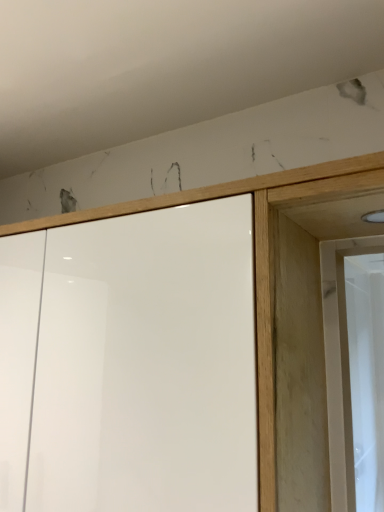
Describe the element at coordinates (362, 376) in the screenshot. I see `white glossy screen door at right` at that location.

Where is `white glossy screen door at right`? This screenshot has height=512, width=384. white glossy screen door at right is located at coordinates (362, 376).

What do you see at coordinates (255, 260) in the screenshot? I see `white glossy cupboard at center` at bounding box center [255, 260].

Identify the location of white glossy cupboard at center. This screenshot has width=384, height=512. (255, 260).

I want to click on white glossy screen door at right, so click(x=362, y=376).

Considering the relative positions of white glossy cupboard at center and white glossy screen door at right in the image provided, is white glossy cupboard at center to the left or to the right of white glossy screen door at right?

In the image, white glossy cupboard at center appears on the left side of white glossy screen door at right.

Which object is further away from the camera taking this photo, white glossy cupboard at center or white glossy screen door at right?

white glossy screen door at right is more distant.

Considering the positions of point (256, 220) and point (364, 348), is point (256, 220) closer or farther from the camera than point (364, 348)?

Point (256, 220) is positioned closer to the camera compared to point (364, 348).

From the image's perspective, is white glossy cupboard at center beneath white glossy screen door at right?

Yes, from the image's perspective, white glossy cupboard at center is below white glossy screen door at right.

From the picture: From a real-world perspective, is white glossy cupboard at center over white glossy screen door at right?

No, from a real-world perspective, white glossy cupboard at center is not over white glossy screen door at right

Which object is thinner, white glossy cupboard at center or white glossy screen door at right?

With smaller width is white glossy screen door at right.

Does white glossy cupboard at center have a greater height compared to white glossy screen door at right?

Yes.

Between white glossy cupboard at center and white glossy screen door at right, which one has larger size?

Bigger between the two is white glossy cupboard at center.

Is white glossy screen door at right located within white glossy cupboard at center?

No, white glossy screen door at right is not surrounded by white glossy cupboard at center.

Is white glossy cupboard at center beside white glossy screen door at right?

No, white glossy cupboard at center is not in contact with white glossy screen door at right.

Could you tell me if white glossy cupboard at center is facing white glossy screen door at right?

No.

Can you tell me how much white glossy cupboard at center and white glossy screen door at right differ in facing direction?

The angular difference between white glossy cupboard at center and white glossy screen door at right is 90 degrees.

Where is `screen door behind the white glossy cupboard at center`? screen door behind the white glossy cupboard at center is located at coordinates (362, 376).

Based on their positions, is white glossy screen door at right located to the left or right of white glossy cupboard at center?

Based on their positions, white glossy screen door at right is located to the right of white glossy cupboard at center.

Is white glossy screen door at right positioned in front of white glossy cupboard at center?

No, white glossy screen door at right is behind white glossy cupboard at center.

Considering the positions of points (359, 293) and (31, 222), is point (359, 293) farther from camera compared to point (31, 222)?

Yes, point (359, 293) is behind point (31, 222).

From the image's perspective, which is above, white glossy screen door at right or white glossy cupboard at center?

From the image's view, white glossy screen door at right is above.

From a real-world perspective, is white glossy screen door at right above or below white glossy cupboard at center?

white glossy screen door at right is situated higher than white glossy cupboard at center in the real world.

Considering the sizes of objects white glossy screen door at right and white glossy cupboard at center in the image provided, who is thinner, white glossy screen door at right or white glossy cupboard at center?

Thinner between the two is white glossy screen door at right.

Considering the sizes of objects white glossy screen door at right and white glossy cupboard at center in the image provided, who is taller, white glossy screen door at right or white glossy cupboard at center?

With more height is white glossy cupboard at center.

Does white glossy screen door at right have a smaller size compared to white glossy cupboard at center?

Indeed, white glossy screen door at right has a smaller size compared to white glossy cupboard at center.

Would you say white glossy screen door at right is inside or outside white glossy cupboard at center?

white glossy screen door at right is outside white glossy cupboard at center.

Is white glossy screen door at right not close to white glossy cupboard at center?

white glossy screen door at right is near white glossy cupboard at center, not far away.

Is white glossy screen door at right oriented away from white glossy cupboard at center?

That's right, white glossy screen door at right is facing away from white glossy cupboard at center.

What's the angular difference between white glossy screen door at right and white glossy cupboard at center's facing directions?

The angular difference between white glossy screen door at right and white glossy cupboard at center is 90 degrees.

You are a GUI agent. You are given a task and a screenshot of the screen. Output one action in this format:
    pyautogui.click(x=<x>, y=<y>)
    Task: Click on the cupboard that is in front of the white glossy screen door at right
    The height and width of the screenshot is (512, 384).
    Given the screenshot: What is the action you would take?
    pyautogui.click(x=255, y=260)

This screenshot has width=384, height=512. In order to click on screen door on the right of white glossy cupboard at center in this screenshot , I will do `click(362, 376)`.

The height and width of the screenshot is (512, 384). Identify the location of cupboard below the white glossy screen door at right (from the image's perspective). (255, 260).